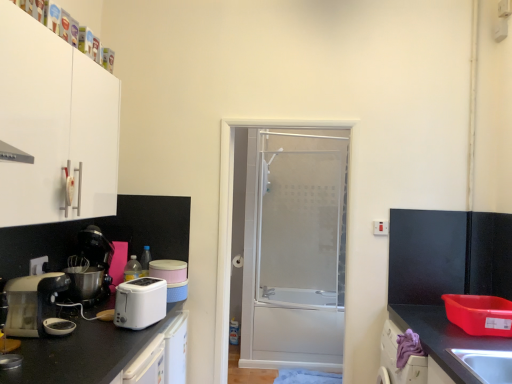
Find the location of `free spot to the right of matte white toaster at left`. free spot to the right of matte white toaster at left is located at coordinates (98, 333).